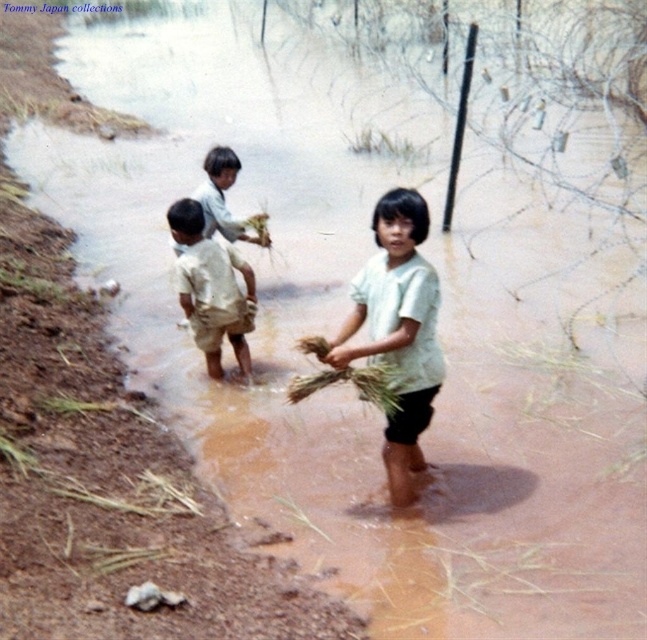
You are a photographer trying to capture the light beige cotton shirt at center in the frame. Based on its position, where should you aim your camera?

The light beige cotton shirt at center is located at coordinates approximately 0.519 on the x axis and 0.617 on the y axis, so aim your camera at that point to capture it.

You are a tailor observing the clothing items in the image. Which item, the light beige cotton shirt at center or the light beige shorts at center, has a greater width measurement?

The light beige cotton shirt at center has a greater width measurement than the light beige shorts at center, as stated in the description that the shirt surpasses the shorts in width.

In the rural scene with three children in shallow water, you notice two items labeled as the light beige cotton shirt at center and the light beige shorts at center. Which of these two items appears taller when viewed from the observer perspective?

The light beige cotton shirt at center appears taller than the light beige shorts at center.